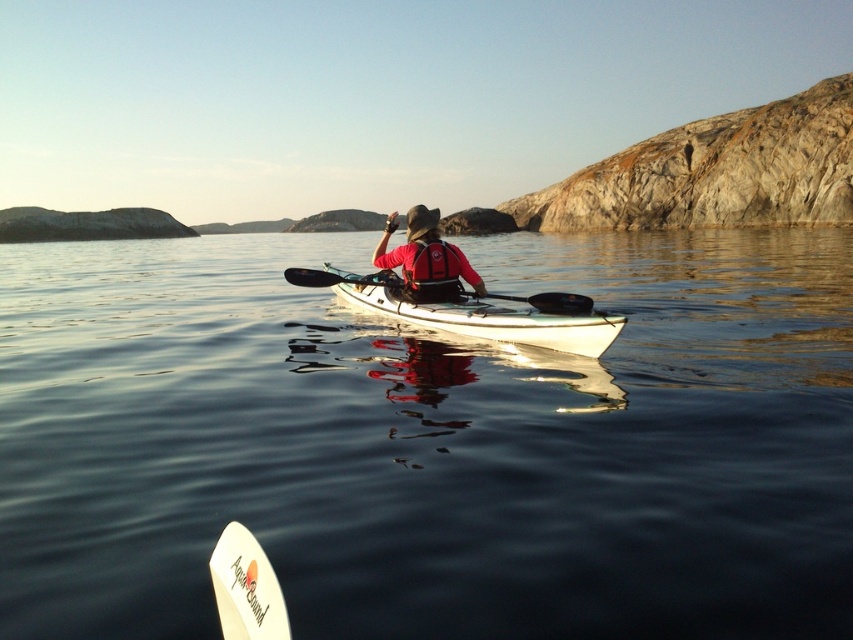
Question: Is white glossy canoe at center bigger than white foam surfboard at lower left?

Choices:
 (A) no
 (B) yes

Answer: (B)

Question: Estimate the real-world distances between objects in this image. Which object is closer to the white glossy canoe at center?

Choices:
 (A) clear water at center
 (B) black plastic paddle at center
 (C) white foam surfboard at lower left

Answer: (B)

Question: Can you confirm if clear water at center is positioned to the left of black plastic paddle at center?

Choices:
 (A) yes
 (B) no

Answer: (A)

Question: Considering the real-world distances, which object is farthest from the black plastic paddle at center?

Choices:
 (A) white foam surfboard at lower left
 (B) white glossy canoe at center
 (C) red matte life jacket at center

Answer: (A)

Question: Is white foam surfboard at lower left to the right of red matte life jacket at center from the viewer's perspective?

Choices:
 (A) no
 (B) yes

Answer: (A)

Question: Which of the following is the farthest from the observer?

Choices:
 (A) red matte life jacket at center
 (B) clear water at center

Answer: (A)